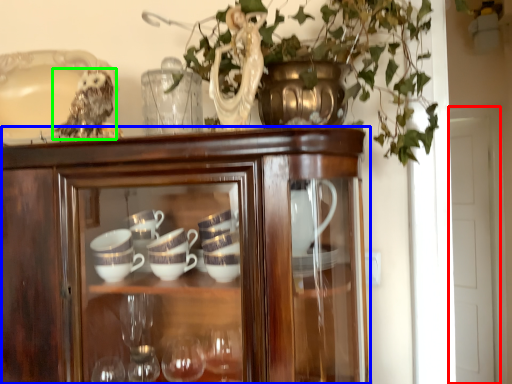
Question: Which object is positioned farthest from glass door (highlighted by a red box)? Select from cupboard (highlighted by a blue box) and owl (highlighted by a green box).

Choices:
 (A) cupboard
 (B) owl

Answer: (B)